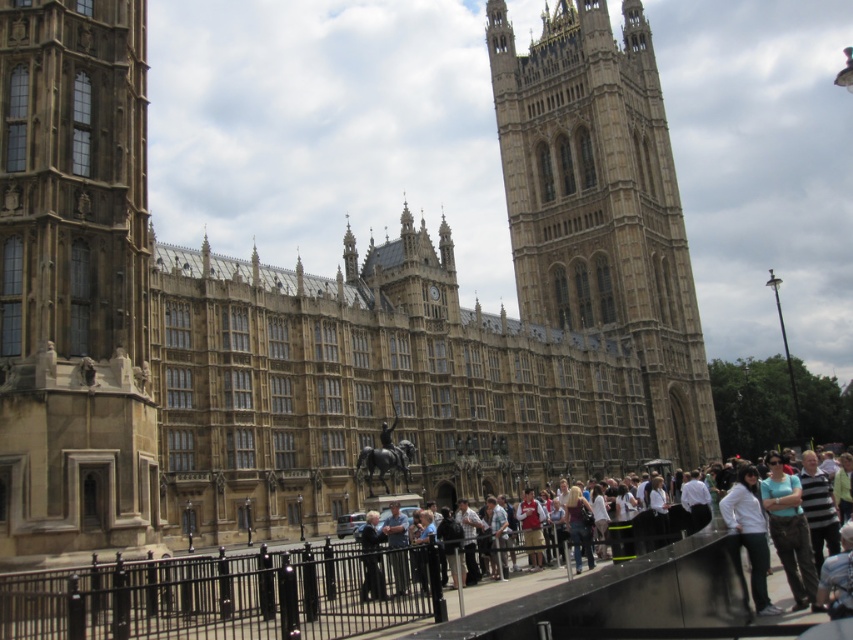
You are an architect assessing the historical building. You notice the brown stone tower at left and the golden stone tower at center. Which tower should you prioritize inspecting if you want to examine the larger structure first?

The golden stone tower at center is larger than the brown stone tower at left, so you should prioritize inspecting the golden stone tower at center first.